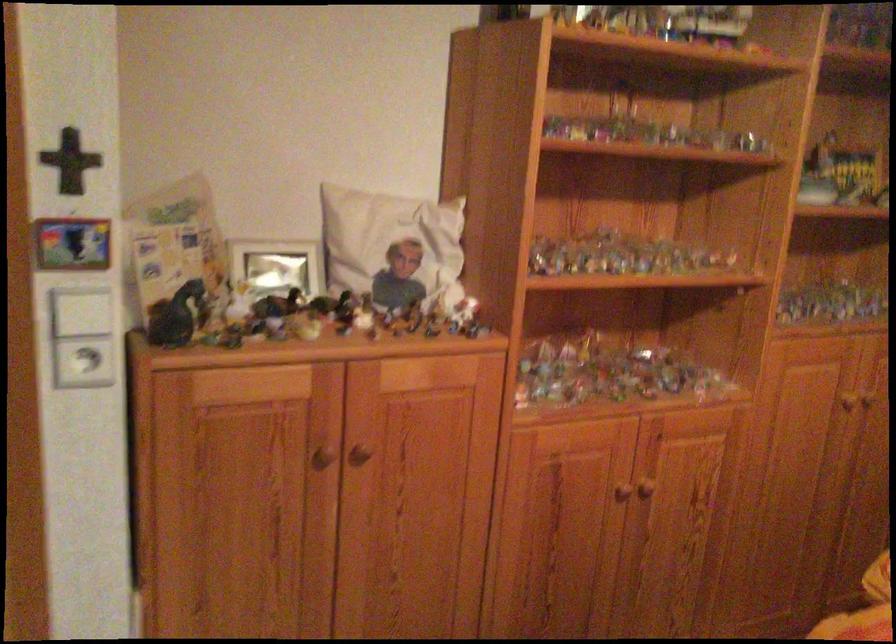
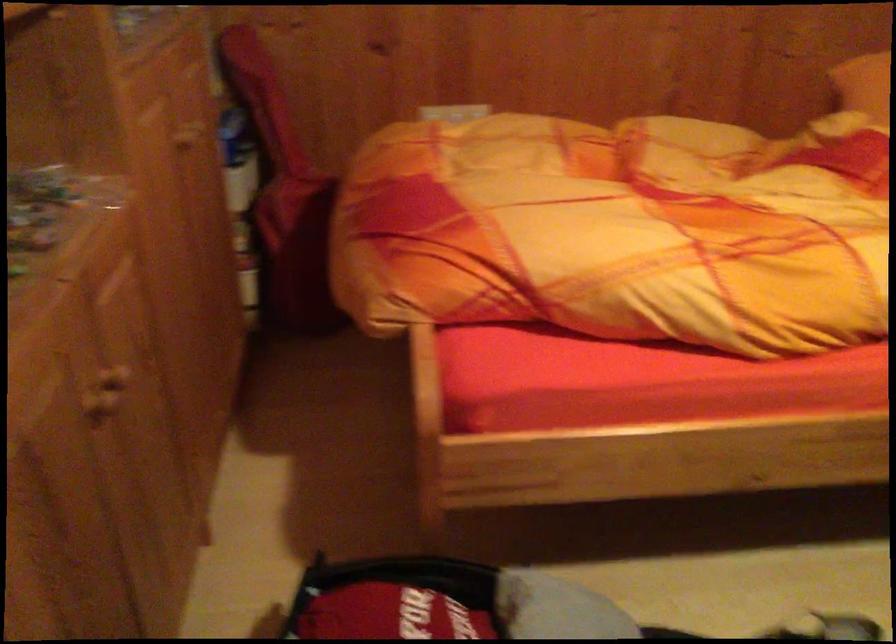
How did the camera likely rotate?

The camera rotated toward right-down.